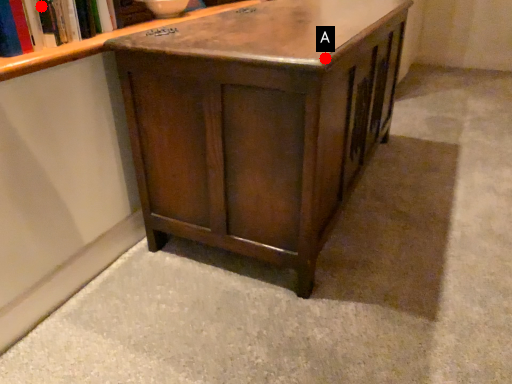
Question: Two points are circled on the image, labeled by A and B beside each circle. Which of the following is the closest to the observer?

Choices:
 (A) A is closer
 (B) B is closer

Answer: (A)